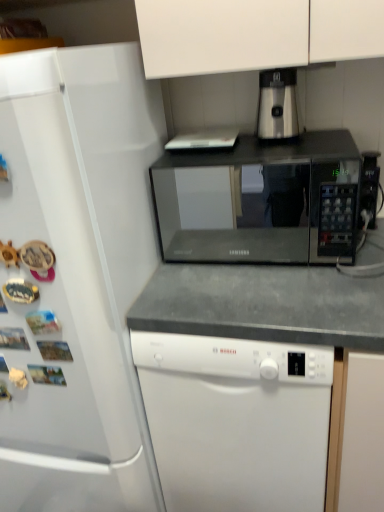
Question: Can you confirm if satin silver coffee machine at upper center is wider than black matte microwave at center?

Choices:
 (A) no
 (B) yes

Answer: (A)

Question: Is satin silver coffee machine at upper center to the left of black matte microwave at center from the viewer's perspective?

Choices:
 (A) yes
 (B) no

Answer: (B)

Question: Could black matte microwave at center be considered to be inside satin silver coffee machine at upper center?

Choices:
 (A) yes
 (B) no

Answer: (B)

Question: From a real-world perspective, is satin silver coffee machine at upper center under black matte microwave at center?

Choices:
 (A) no
 (B) yes

Answer: (A)

Question: Is satin silver coffee machine at upper center to the right of black matte microwave at center from the viewer's perspective?

Choices:
 (A) yes
 (B) no

Answer: (A)

Question: From a real-world perspective, is black matte microwave at center positioned above or below white matte dishwasher at center?

Choices:
 (A) above
 (B) below

Answer: (A)

Question: Is black matte microwave at center spatially inside white matte dishwasher at center, or outside of it?

Choices:
 (A) outside
 (B) inside

Answer: (A)

Question: Considering the positions of black matte microwave at center and white matte dishwasher at center in the image, is black matte microwave at center wider or thinner than white matte dishwasher at center?

Choices:
 (A) wide
 (B) thin

Answer: (B)

Question: Considering the positions of black matte microwave at center and white matte dishwasher at center in the image, is black matte microwave at center taller or shorter than white matte dishwasher at center?

Choices:
 (A) tall
 (B) short

Answer: (B)

Question: Is satin silver coffee machine at upper center in front of or behind black matte microwave at center in the image?

Choices:
 (A) behind
 (B) front

Answer: (A)

Question: Does point (268, 79) appear closer or farther from the camera than point (336, 142)?

Choices:
 (A) closer
 (B) farther

Answer: (A)

Question: Choose the correct answer: Is satin silver coffee machine at upper center inside black matte microwave at center or outside it?

Choices:
 (A) outside
 (B) inside

Answer: (A)

Question: Is satin silver coffee machine at upper center wider or thinner than black matte microwave at center?

Choices:
 (A) thin
 (B) wide

Answer: (A)

Question: From their relative heights in the image, would you say white matte dishwasher at center is taller or shorter than black matte microwave at center?

Choices:
 (A) tall
 (B) short

Answer: (A)

Question: Is point (193, 445) positioned closer to the camera than point (183, 169)?

Choices:
 (A) closer
 (B) farther

Answer: (A)